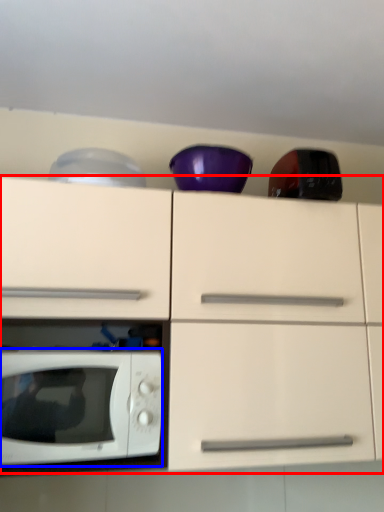
Question: Among these objects, which one is nearest to the camera, cabinetry (highlighted by a red box) or microwave oven (highlighted by a blue box)?

Choices:
 (A) cabinetry
 (B) microwave oven

Answer: (A)